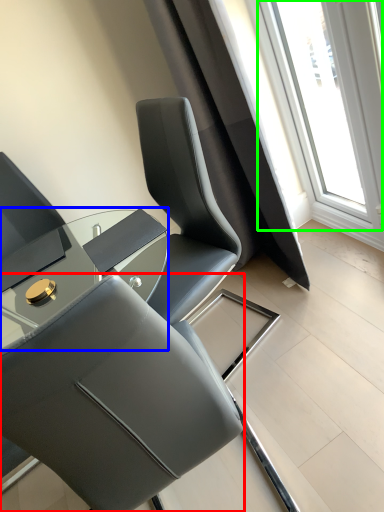
Question: Based on their relative distances, which object is farther from chair (highlighted by a red box)? Choose from table (highlighted by a blue box) and window (highlighted by a green box).

Choices:
 (A) table
 (B) window

Answer: (B)